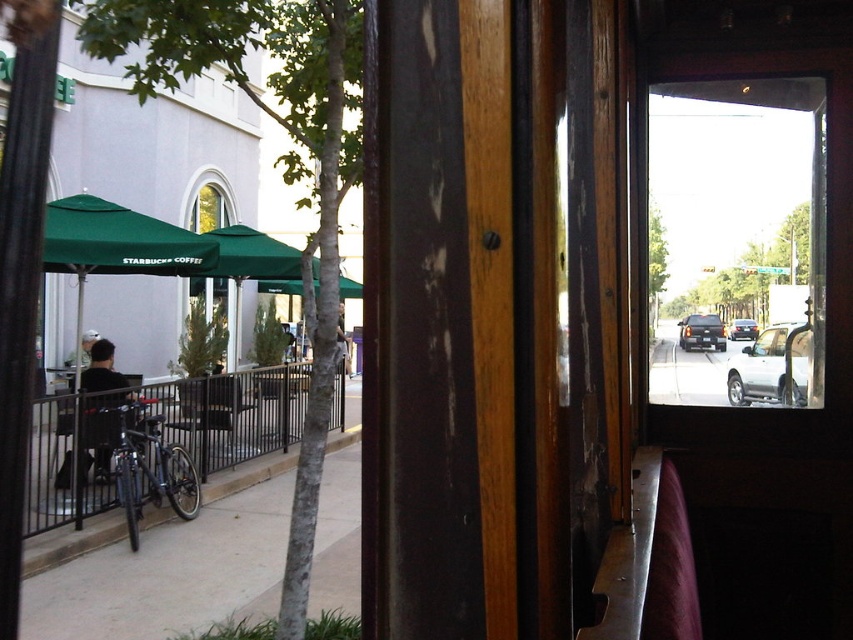
Can you confirm if gray concrete sidewalk at lower left is thinner than dark brown leather jacket at center?

Correct, gray concrete sidewalk at lower left's width is less than dark brown leather jacket at center's.

Based on the photo, is gray concrete sidewalk at lower left shorter than dark brown leather jacket at center?

Yes.

Image resolution: width=853 pixels, height=640 pixels. What do you see at coordinates (169, 573) in the screenshot?
I see `gray concrete sidewalk at lower left` at bounding box center [169, 573].

Identify the location of gray concrete sidewalk at lower left. (169, 573).

Does point (80, 211) come in front of point (730, 326)?

No, it is behind (730, 326).

Is point (67, 212) closer to viewer compared to point (738, 324)?

No, (67, 212) is behind (738, 324).

What are the coordinates of `green fabric umbrella at left` in the screenshot? It's located at (119, 241).

Can you confirm if dark gray shirt at center is taller than dark brown leather jacket at center?

In fact, dark gray shirt at center may be shorter than dark brown leather jacket at center.

In the scene shown: Does dark gray shirt at center appear on the right side of dark brown leather jacket at center?

No, dark gray shirt at center is not to the right of dark brown leather jacket at center.

Is point (85, 376) positioned behind point (338, 344)?

No, it is in front of (338, 344).

Image resolution: width=853 pixels, height=640 pixels. I want to click on dark gray shirt at center, so click(x=102, y=369).